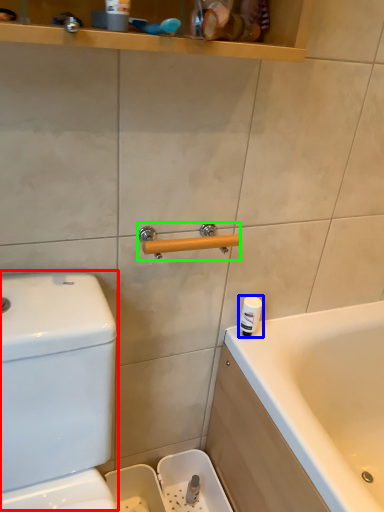
Question: Which is nearer to the water tank (highlighted by a red box)? toiletry (highlighted by a blue box) or door handle (highlighted by a green box).

Choices:
 (A) toiletry
 (B) door handle

Answer: (B)